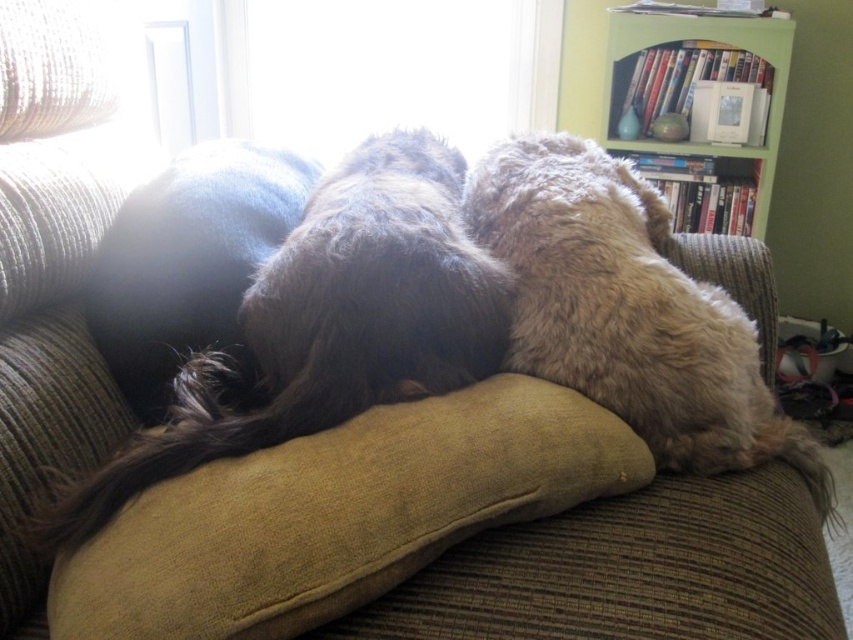
Question: Which object is farther from the camera taking this photo?

Choices:
 (A) green wood bookshelf at upper right
 (B) mustard yellow fabric pillow at center
 (C) transparent glass window at upper center
 (D) fuzzy beige dog at center

Answer: (C)

Question: Is fluffy brown dog at center further to camera compared to green wood bookshelf at upper right?

Choices:
 (A) yes
 (B) no

Answer: (B)

Question: Does mustard yellow fabric pillow at center have a lesser width compared to transparent glass window at upper center?

Choices:
 (A) yes
 (B) no

Answer: (A)

Question: Is fuzzy beige dog at center bigger than green wood bookshelf at upper right?

Choices:
 (A) no
 (B) yes

Answer: (B)

Question: Estimate the real-world distances between objects in this image. Which object is farther from the green wood bookshelf at upper right?

Choices:
 (A) fluffy brown dog at center
 (B) dark blue fabric at center

Answer: (B)

Question: Which point appears farthest from the camera in this image?

Choices:
 (A) (352, 116)
 (B) (538, 436)

Answer: (A)